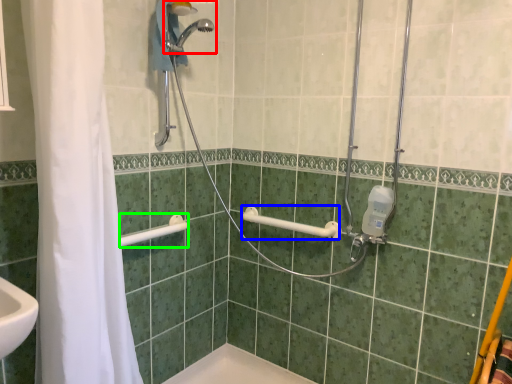
Question: Based on their relative distances, which object is nearer to shower (highlighted by a red box)? Choose from towel bar (highlighted by a blue box) and shower (highlighted by a green box).

Choices:
 (A) towel bar
 (B) shower

Answer: (B)